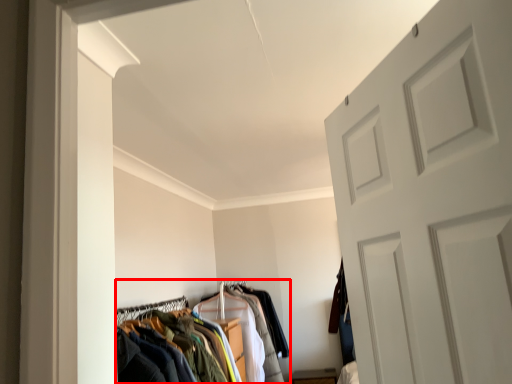
Question: From the image's perspective, considering the relative positions of closet (annotated by the red box) and clothing in the image provided, where is closet (annotated by the red box) located with respect to the staircase?

Choices:
 (A) above
 (B) below

Answer: (A)